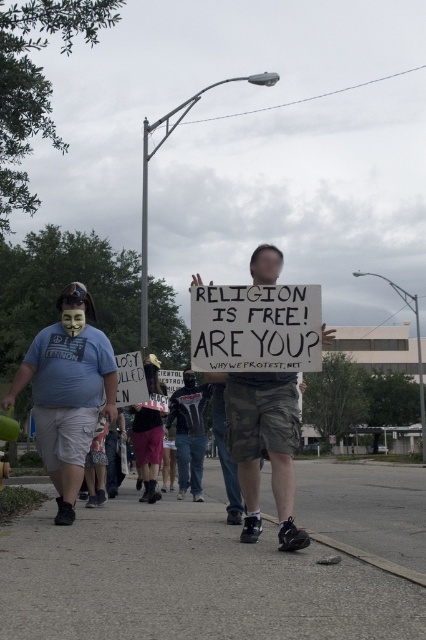
Is matte blue t-shirt at left below black leather jacket at center?

Incorrect, matte blue t-shirt at left is not positioned below black leather jacket at center.

Who is more distant from viewer, (68, 410) or (192, 490)?

The point (192, 490) is behind.

This screenshot has width=426, height=640. Find the location of `matte blue t-shirt at left`. matte blue t-shirt at left is located at coordinates click(x=68, y=392).

Describe the element at coordinates (187, 579) in the screenshot. This screenshot has height=640, width=426. I see `gray asphalt pavement at lower center` at that location.

Who is more distant from viewer, (x=34, y=609) or (x=284, y=492)?

The point (x=284, y=492) is behind.

The image size is (426, 640). I want to click on gray asphalt pavement at lower center, so click(x=187, y=579).

Between gray asphalt pavement at lower center and black leather jacket at center, which one has more height?

gray asphalt pavement at lower center

Does gray asphalt pavement at lower center appear on the left side of black leather jacket at center?

In fact, gray asphalt pavement at lower center is to the right of black leather jacket at center.

Between point (267, 538) and point (207, 401), which one is positioned in front?

Positioned in front is point (267, 538).

The image size is (426, 640). I want to click on gray asphalt pavement at lower center, so click(x=187, y=579).